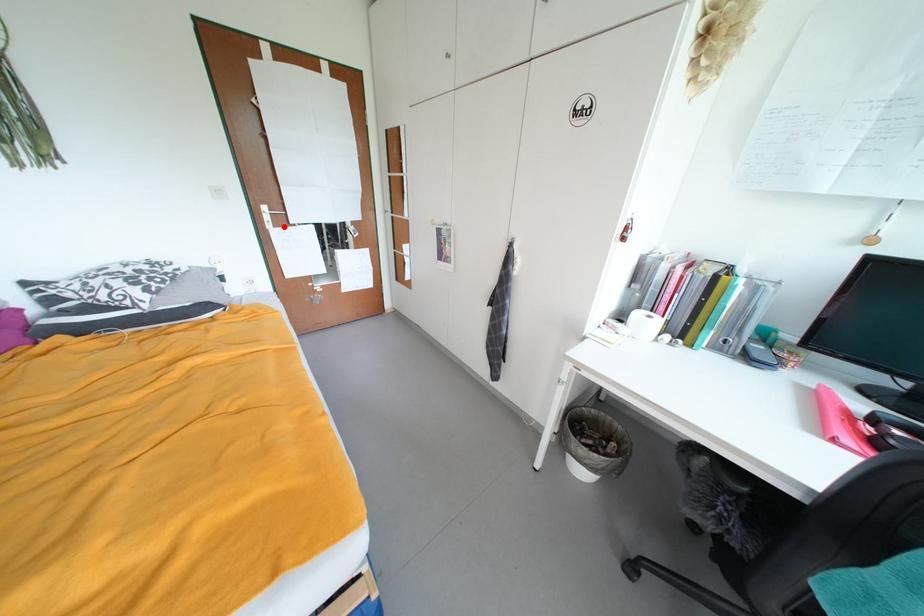
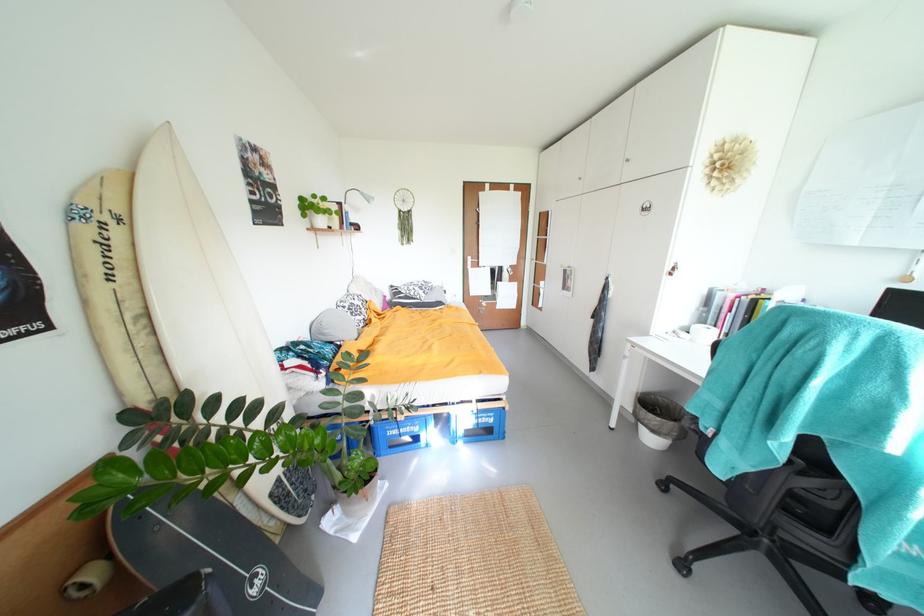
Locate, in the second image, the point that corresponds to the highlighted location in the first image.

(480, 268)